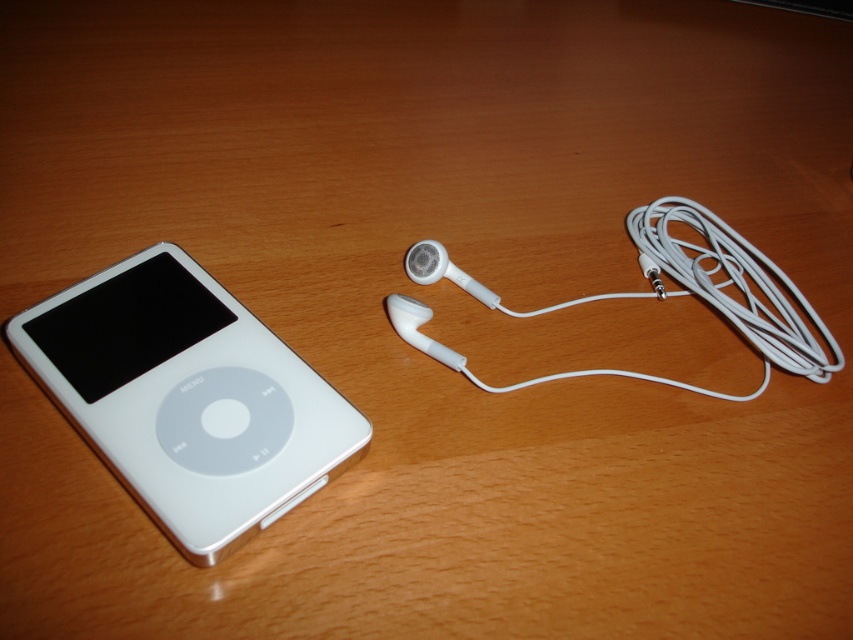
Question: Can you confirm if white plastic ipod at left is positioned to the left of white matte earphone at center right?

Choices:
 (A) no
 (B) yes

Answer: (B)

Question: Which point is closer to the camera?

Choices:
 (A) white plastic ipod at left
 (B) white matte earphone at center right

Answer: (A)

Question: Which point is farther to the camera?

Choices:
 (A) white plastic ipod at left
 (B) white matte earphone at center right

Answer: (B)

Question: Does white plastic ipod at left have a lesser width compared to white matte earphone at center right?

Choices:
 (A) yes
 (B) no

Answer: (A)

Question: Can you confirm if white plastic ipod at left is thinner than white matte earphone at center right?

Choices:
 (A) no
 (B) yes

Answer: (B)